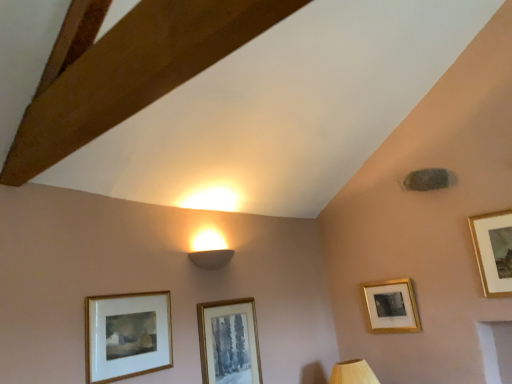
Question: Can you confirm if gold-framed picture at lower left, which is counted as the fourth picture frame, starting from the back, is shorter than gold-framed picture at upper right, the fourth picture frame viewed from the left?

Choices:
 (A) no
 (B) yes

Answer: (B)

Question: Can you confirm if gold-framed picture at lower left, which is counted as the fourth picture frame, starting from the back, is taller than gold-framed picture at upper right, which is the third picture frame in front-to-back order?

Choices:
 (A) no
 (B) yes

Answer: (A)

Question: Considering the relative positions of gold-framed picture at lower left, placed as the 1th picture frame when sorted from left to right, and gold-framed picture at upper right, which ranks as the 1th picture frame in right-to-left order, in the image provided, is gold-framed picture at lower left, placed as the 1th picture frame when sorted from left to right, to the left of gold-framed picture at upper right, which ranks as the 1th picture frame in right-to-left order, from the viewer's perspective?

Choices:
 (A) no
 (B) yes

Answer: (B)

Question: Would you say gold-framed picture at lower left, marked as the fourth picture frame in a right-to-left arrangement, is a long distance from gold-framed picture at upper right, marked as the 2th picture frame in a back-to-front arrangement?

Choices:
 (A) no
 (B) yes

Answer: (B)

Question: Does gold-framed picture at lower left, placed as the 1th picture frame when sorted from left to right, have a smaller size compared to gold-framed picture at upper right, the fourth picture frame viewed from the left?

Choices:
 (A) no
 (B) yes

Answer: (B)

Question: Is gold-framed picture at lower left, placed as the 1th picture frame when sorted from left to right, thinner than gold-framed picture at upper right, marked as the 2th picture frame in a back-to-front arrangement?

Choices:
 (A) yes
 (B) no

Answer: (A)

Question: Does gold-framed picture at lower left, marked as the fourth picture frame in a right-to-left arrangement, have a greater width compared to white matte wall sconce at upper center?

Choices:
 (A) no
 (B) yes

Answer: (A)

Question: From the image's perspective, would you say gold-framed picture at lower left, placed as the 1th picture frame when sorted from left to right, is shown under white matte wall sconce at upper center?

Choices:
 (A) no
 (B) yes

Answer: (B)

Question: Can you confirm if gold-framed picture at lower left, marked as the fourth picture frame in a right-to-left arrangement, is positioned to the left of white matte wall sconce at upper center?

Choices:
 (A) yes
 (B) no

Answer: (A)

Question: Is gold-framed picture at lower left, marked as the fourth picture frame in a right-to-left arrangement, taller than white matte wall sconce at upper center?

Choices:
 (A) no
 (B) yes

Answer: (B)

Question: From the image's perspective, does gold-framed picture at lower left, placed as the 1th picture frame when sorted from left to right, appear higher than white matte wall sconce at upper center?

Choices:
 (A) yes
 (B) no

Answer: (B)

Question: Can you confirm if gold-framed picture at lower left, placed as the 1th picture frame when sorted from left to right, is smaller than white matte wall sconce at upper center?

Choices:
 (A) no
 (B) yes

Answer: (A)

Question: From a real-world perspective, is gold-framed picture at upper right, marked as the 2th picture frame in a back-to-front arrangement, physically below matte gold picture frame at center, which appears as the 3th picture frame when viewed from the right?

Choices:
 (A) yes
 (B) no

Answer: (B)